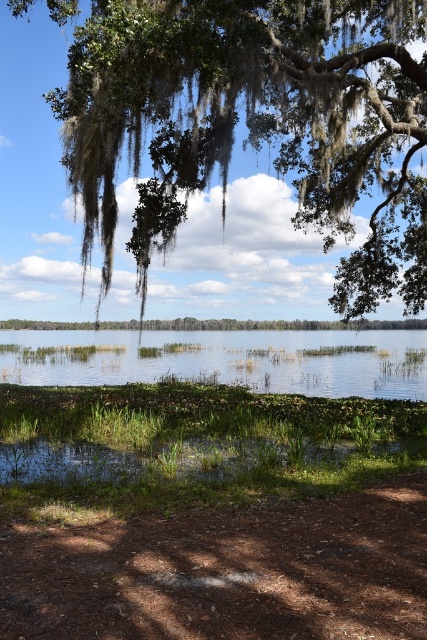
Question: Which object appears farthest from the camera in this image?

Choices:
 (A) green mossy oak tree at upper left
 (B) clear water at center

Answer: (B)

Question: Considering the relative positions of green mossy oak tree at upper left and clear water at center in the image provided, where is green mossy oak tree at upper left located with respect to clear water at center?

Choices:
 (A) below
 (B) above

Answer: (B)

Question: Is green mossy oak tree at upper left thinner than clear water at center?

Choices:
 (A) yes
 (B) no

Answer: (A)

Question: Is green mossy oak tree at upper left to the left of clear water at center from the viewer's perspective?

Choices:
 (A) no
 (B) yes

Answer: (A)